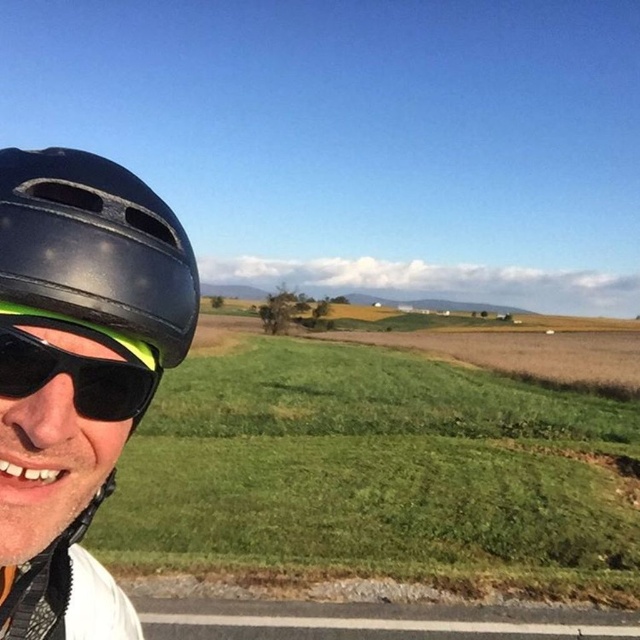
You are navigating a drone from the starting point to the destination point in the scene. The starting point is point [84,154] and the destination is point [1,364]. According to the scene description, which point is closer to the camera?

Point [1,364] is closer to the camera since point [84,154] is behind it.

You are a photographer trying to capture the scene with both the black matte helmet at left and the matte black helmet at left in the frame. Which helmet should you adjust your camera angle to focus on first if you want to include both in your shot?

The black matte helmet at left is to the left of the matte black helmet at left, so you should focus on the black matte helmet at left first to ensure both are in the frame.

You are a photographer trying to capture the cyclist wearing the black matte helmet at left and black matte sunglasses at left. If you want to ensure both items are clearly visible in your photo, which one should you focus on first considering their sizes?

The black matte helmet at left is larger in size than the black matte sunglasses at left, so you should focus on the black matte helmet at left first to ensure it is clearly visible.